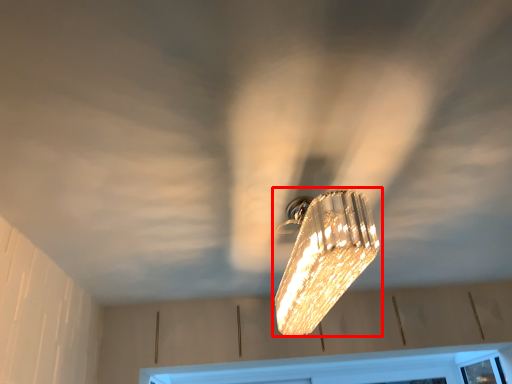
Question: From the image's perspective, what is the correct spatial positioning of lamp (annotated by the red box) in reference to window frame?

Choices:
 (A) above
 (B) below

Answer: (A)